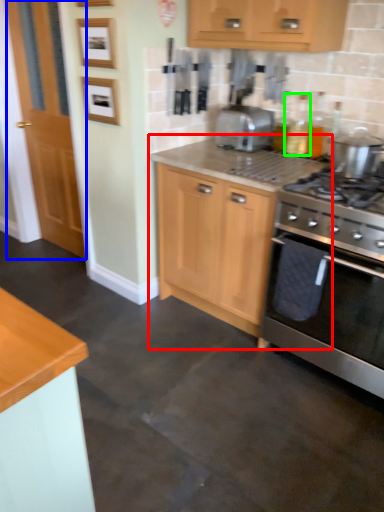
Question: Which object is the farthest from cabinetry (highlighted by a red box)? Choose among these: door (highlighted by a blue box) or bottle (highlighted by a green box).

Choices:
 (A) door
 (B) bottle

Answer: (A)